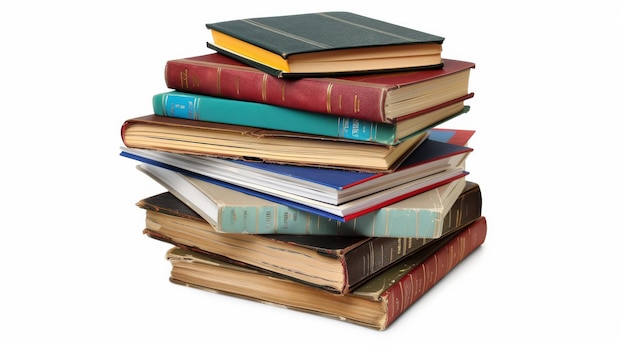
Identify the location of spine of book. This screenshot has width=626, height=351. (360, 115), (380, 135), (408, 224), (366, 260), (412, 284).